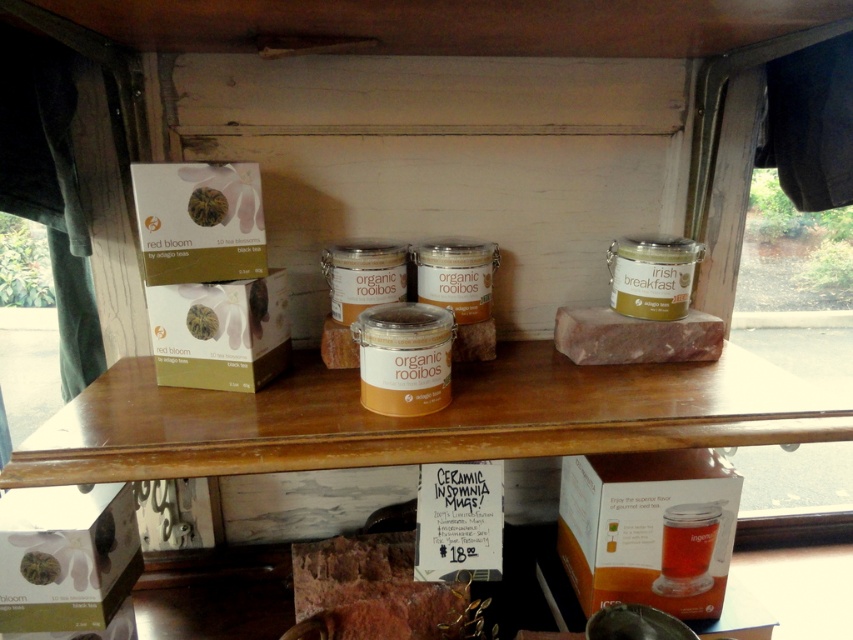
You are a customer in the store and you want to reach both the tea boxes and the organic rooibos containers. Which of the two points, point A at coordinates point [335,634] or point B at coordinates point [136,189], is closer to you when standing in front of the shelf?

Point B at coordinates point [136,189] is closer to you because it is in front of point A at coordinates point [335,634].

You are a store employee who needs to place a new item on the shelf. The item requires at least 8 inches of space between it and the green matte box at center. Can you place it on the wooden shelf at center?

The wooden shelf at center is only 7.28 inches from the green matte box at center, which is less than the required 8 inches. Therefore, you cannot place the item there.